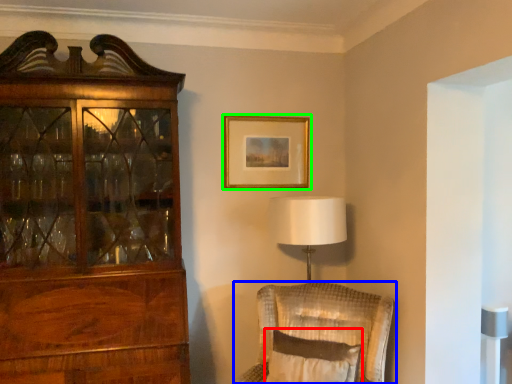
Question: Which object is positioned closest to pillow (highlighted by a red box)? Select from chair (highlighted by a blue box) and picture frame (highlighted by a green box).

Choices:
 (A) chair
 (B) picture frame

Answer: (A)